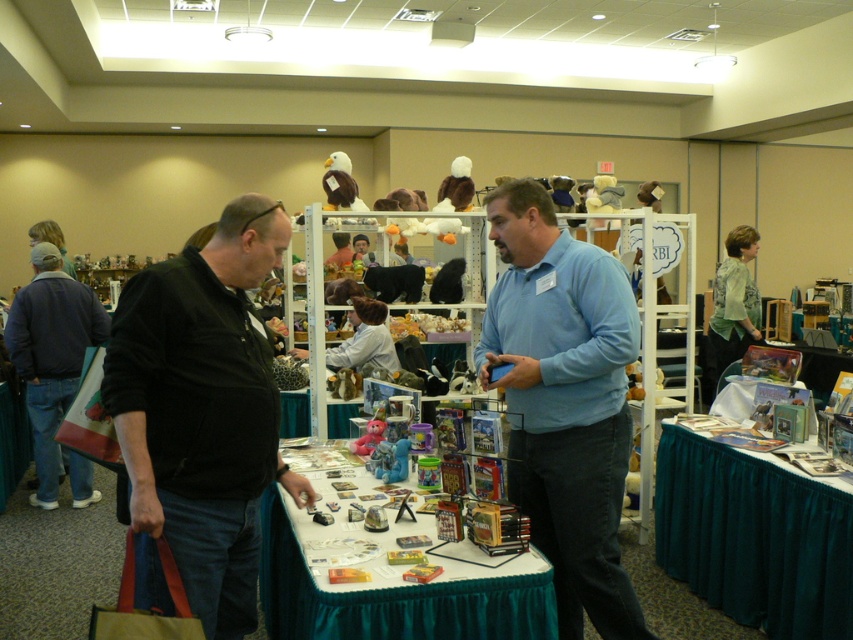
Question: Which object appears farthest from the camera in this image?

Choices:
 (A) velvety pink teddy bear at center
 (B) blue cotton shirt at center
 (C) blue rubber toy at center
 (D) white plush eagle at upper center

Answer: (D)

Question: Among these objects, which one is farthest from the camera?

Choices:
 (A) white plush duck at center
 (B) black corduroy jacket at left
 (C) blue rubber toy at center

Answer: (A)

Question: Which of the following is the farthest from the observer?

Choices:
 (A) (509, 579)
 (B) (360, 209)
 (C) (28, 304)
 (D) (247, 556)

Answer: (C)

Question: Can you confirm if black corduroy jacket at left is positioned to the left of white plush eagle at upper center?

Choices:
 (A) yes
 (B) no

Answer: (B)

Question: Can you confirm if blue cotton shirt at center is smaller than green velvet table at lower right?

Choices:
 (A) no
 (B) yes

Answer: (A)

Question: Where is black corduroy jacket at left located in relation to denim jacket at left in the image?

Choices:
 (A) right
 (B) left

Answer: (A)